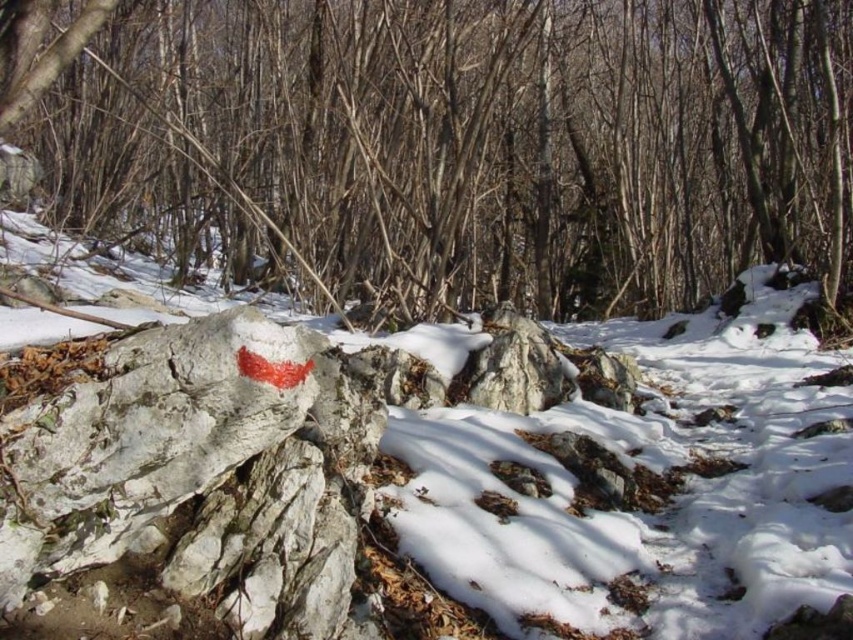
You are a hiker with a 4.5 meter long rope. You want to tie the rope between the camera position and the smooth bark tree at center. Is the rope long enough?

The distance between the smooth bark tree at center and the camera is 4.48 meters, so the 4.5 meter long rope is sufficient to tie between the two points.

You are a photographer standing in the wintry forest scene. You want to take a photo that includes both the bright red trail marker and the snow. Which of the two points, point (x=537, y=506) or point (x=561, y=378), is closer to your camera position?

Point (x=537, y=506) is closer to the camera than point (x=561, y=378).